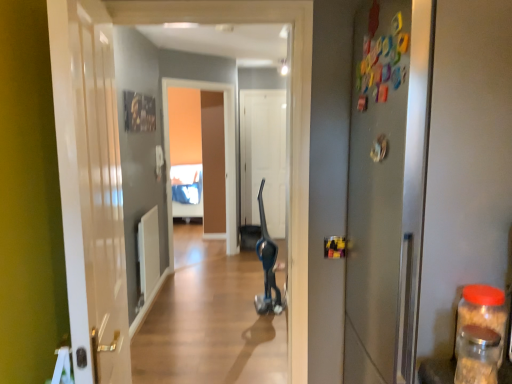
Question: Can you confirm if transparent glass jar at right, the 2th bottle in the back-to-front sequence, is shorter than white matte door at center, which ranks as the third door in front-to-back order?

Choices:
 (A) no
 (B) yes

Answer: (B)

Question: Considering the relative sizes of transparent glass jar at right, the 2th bottle in the back-to-front sequence, and white matte door at center, which ranks as the third door in front-to-back order, in the image provided, is transparent glass jar at right, the 2th bottle in the back-to-front sequence, taller than white matte door at center, which ranks as the third door in front-to-back order,?

Choices:
 (A) yes
 (B) no

Answer: (B)

Question: Would you say transparent glass jar at right, the 1th bottle viewed from the front, contains white matte door at center, which ranks as the third door in front-to-back order?

Choices:
 (A) yes
 (B) no

Answer: (B)

Question: Can you confirm if transparent glass jar at right, the 1th bottle viewed from the front, is positioned to the left of white matte door at center, marked as the first door in a back-to-front arrangement?

Choices:
 (A) no
 (B) yes

Answer: (A)

Question: Is transparent glass jar at right, the 2th bottle in the back-to-front sequence, thinner than white matte door at center, which ranks as the third door in front-to-back order?

Choices:
 (A) yes
 (B) no

Answer: (B)

Question: Is white glossy door at left, which is the first door in left-to-right order, bigger or smaller than transparent plastic jar at right, which appears as the 2th bottle when viewed from the front?

Choices:
 (A) small
 (B) big

Answer: (B)

Question: From the image's perspective, is white glossy door at left, placed as the third door when sorted from back to front, above or below transparent plastic jar at right, which appears as the 2th bottle when viewed from the front?

Choices:
 (A) below
 (B) above

Answer: (B)

Question: From a real-world perspective, is white glossy door at left, which is the first door in left-to-right order, physically located above or below transparent plastic jar at right, acting as the first bottle starting from the back?

Choices:
 (A) below
 (B) above

Answer: (B)

Question: Considering their positions, is white glossy door at left, which is the first door in left-to-right order, located in front of or behind transparent plastic jar at right, acting as the first bottle starting from the back?

Choices:
 (A) behind
 (B) front

Answer: (B)

Question: From the image's perspective, is transparent plastic jar at right, acting as the first bottle starting from the back, positioned above or below metallic gray door at right, which is the 2th door from back to front?

Choices:
 (A) below
 (B) above

Answer: (A)

Question: Considering the positions of transparent plastic jar at right, which appears as the 2th bottle when viewed from the front, and metallic gray door at right, the third door from the left, in the image, is transparent plastic jar at right, which appears as the 2th bottle when viewed from the front, taller or shorter than metallic gray door at right, the third door from the left,?

Choices:
 (A) tall
 (B) short

Answer: (B)

Question: From a real-world perspective, is transparent plastic jar at right, which appears as the 2th bottle when viewed from the front, physically located above or below metallic gray door at right, the third door from the left?

Choices:
 (A) below
 (B) above

Answer: (A)

Question: Considering the positions of transparent plastic jar at right, acting as the first bottle starting from the back, and metallic gray door at right, the third door from the left, in the image, is transparent plastic jar at right, acting as the first bottle starting from the back, bigger or smaller than metallic gray door at right, the third door from the left,?

Choices:
 (A) big
 (B) small

Answer: (B)

Question: From a real-world perspective, is white glossy door at left, which ranks as the third door in right-to-left order, physically located above or below metallic gray door at right, the third door from the left?

Choices:
 (A) above
 (B) below

Answer: (B)

Question: In terms of size, does white glossy door at left, which is the first door in left-to-right order, appear bigger or smaller than metallic gray door at right, the third door from the left?

Choices:
 (A) small
 (B) big

Answer: (A)